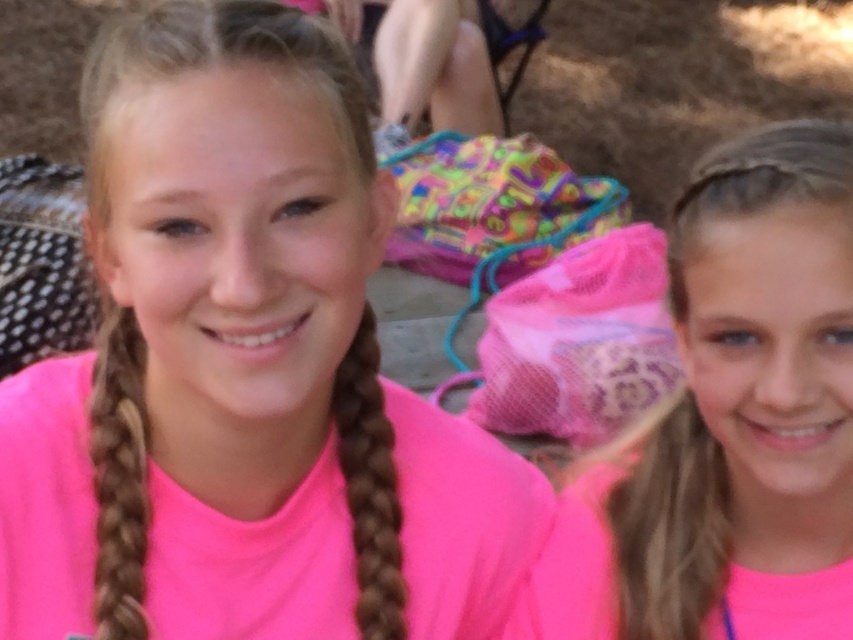
You are a photographer trying to capture both the pink fabric hair at right and the brown braided hair at center in a single frame. Considering their sizes, which one should you focus on to ensure both fit well in the photo?

The pink fabric hair at right is bigger than the brown braided hair at center, so you should focus on the pink fabric hair at right to ensure both fit well in the photo.

You are standing at a distance and want to reach the point marked as point (126, 131). If your average walking pace is 3 miles per hour, how long will it take you to reach that point?

The distance to point (126, 131) is 34.79 inches. Converting this to miles, 34.79 inches is approximately 0.00054 miles. At a walking pace of 3 mph, the time required would be roughly 0.00018 hours, which is about 0.66 seconds.

You are a photographer trying to capture both the pink fabric shirt at center and the pink fabric hair at right in a single frame. Since the shirt is larger, where should you position your camera to ensure both objects are clearly visible?

The pink fabric shirt at center is larger in size than the pink fabric hair at right, so you should position the camera closer to the pink fabric hair at right to balance their sizes in the frame.